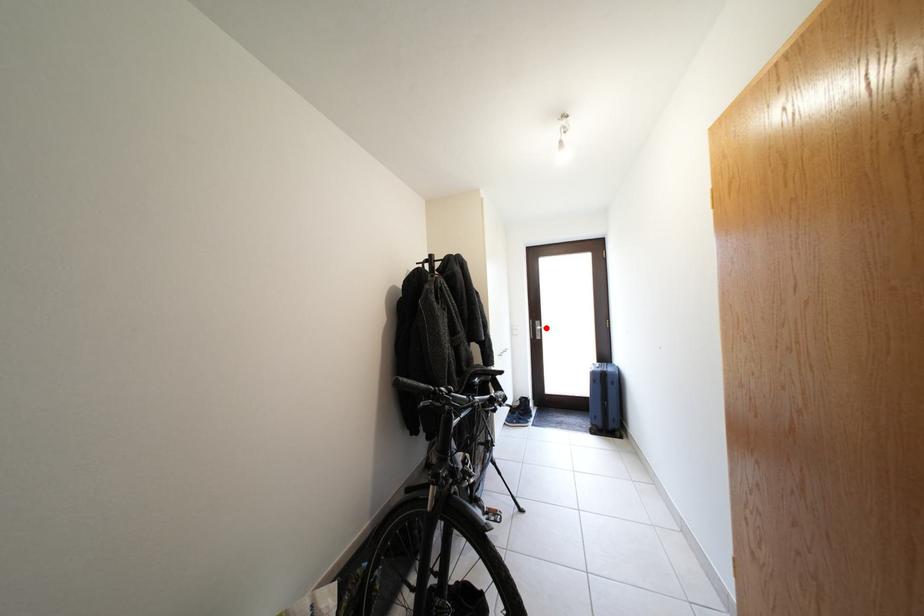
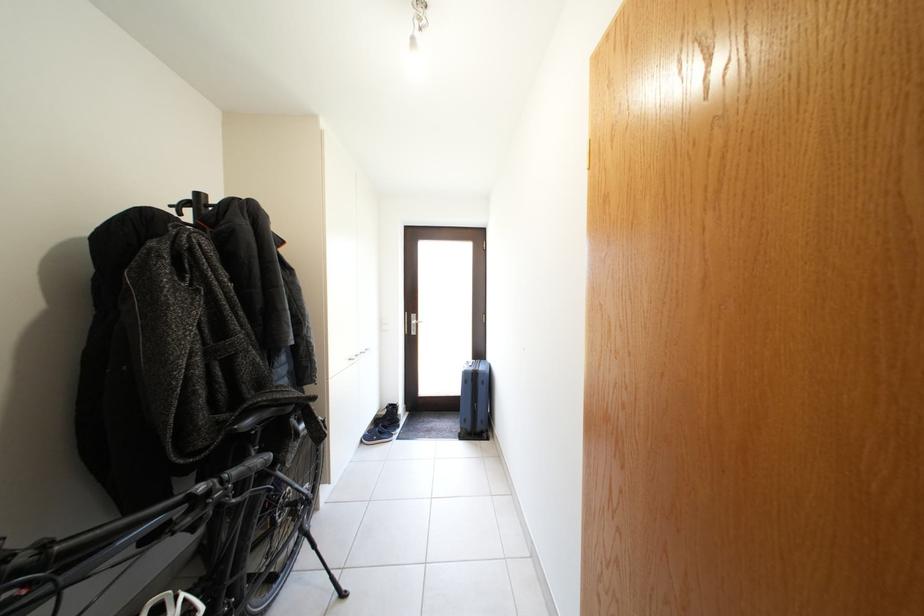
The point at the highlighted location is marked in the first image. Where is the corresponding point in the second image?

(421, 322)